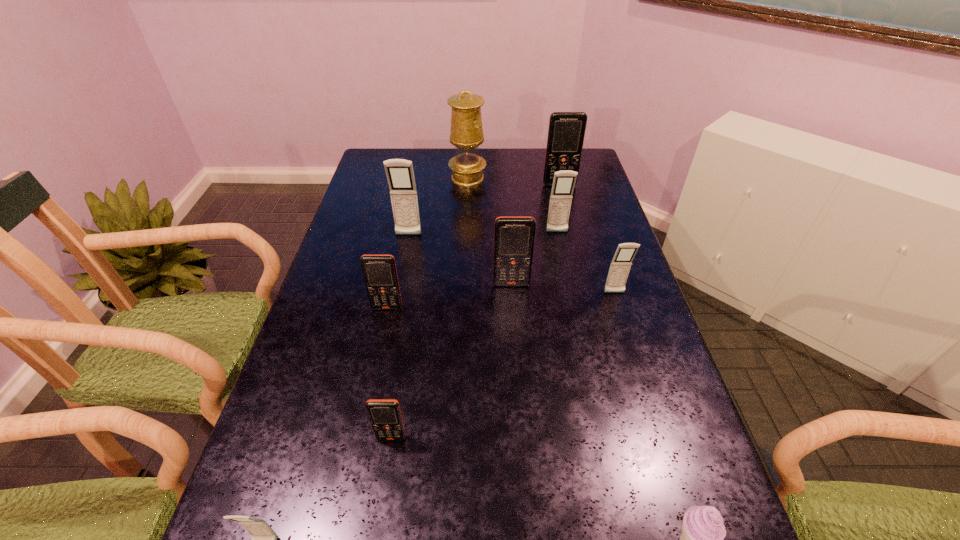
The image size is (960, 540). I want to click on oil lamp, so click(466, 134).

Find the location of a particular element. The height and width of the screenshot is (540, 960). the fifth object from left to right is located at coordinates (466, 134).

This screenshot has width=960, height=540. Identify the location of the rightmost orange cellular telephone. (566, 131).

This screenshot has width=960, height=540. In order to click on the farthest orange cellular telephone in this screenshot , I will do `click(566, 131)`.

The height and width of the screenshot is (540, 960). In order to click on the biggest gray cellular telephone in this screenshot , I will do `click(400, 175)`.

Image resolution: width=960 pixels, height=540 pixels. I want to click on the second gray cellular telephone from right to left, so click(564, 181).

Find the location of a particular element. Image resolution: width=960 pixels, height=540 pixels. the third orange cellular telephone from left to right is located at coordinates (514, 236).

Where is `the third nearest orange cellular telephone`? Image resolution: width=960 pixels, height=540 pixels. the third nearest orange cellular telephone is located at coordinates (514, 236).

Locate an element on the screen. This screenshot has width=960, height=540. the fourth nearest cellular telephone is located at coordinates (621, 263).

You are a GUI agent. You are given a task and a screenshot of the screen. Output one action in this format:
    pyautogui.click(x=<x>, y=<y>)
    Task: Click on the fifth nearest object
    The image size is (960, 540).
    Given the screenshot: What is the action you would take?
    pyautogui.click(x=621, y=263)